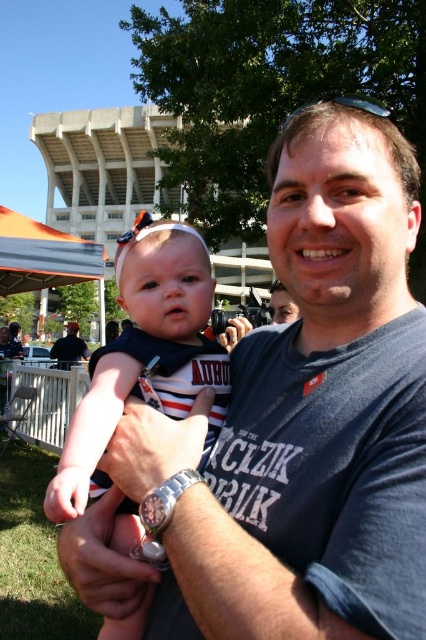
Is dark blue t-shirt at center above black cotton shirt at center?

Yes, dark blue t-shirt at center is above black cotton shirt at center.

Is dark blue t-shirt at center wider than black cotton shirt at center?

In fact, dark blue t-shirt at center might be narrower than black cotton shirt at center.

What do you see at coordinates (317, 413) in the screenshot? I see `dark blue t-shirt at center` at bounding box center [317, 413].

At what (x,y) coordinates should I click in order to perform the action: click on dark blue t-shirt at center. Please return your answer as a coordinate pair (x, y). Looking at the image, I should click on click(x=317, y=413).

Between point (152, 317) and point (68, 364), which one is positioned behind?

The point (68, 364) is more distant.

Which is behind, point (155, 257) or point (74, 324)?

Point (74, 324)

Where is `striped jersey baby at center`? The height and width of the screenshot is (640, 426). striped jersey baby at center is located at coordinates (146, 355).

Which is more to the right, dark blue t-shirt at center or striped jersey baby at center?

dark blue t-shirt at center is more to the right.

Is point (178, 625) positioned after point (190, 349)?

No.

At what (x,y) coordinates should I click in order to perform the action: click on dark blue t-shirt at center. Please return your answer as a coordinate pair (x, y). The height and width of the screenshot is (640, 426). Looking at the image, I should click on (317, 413).